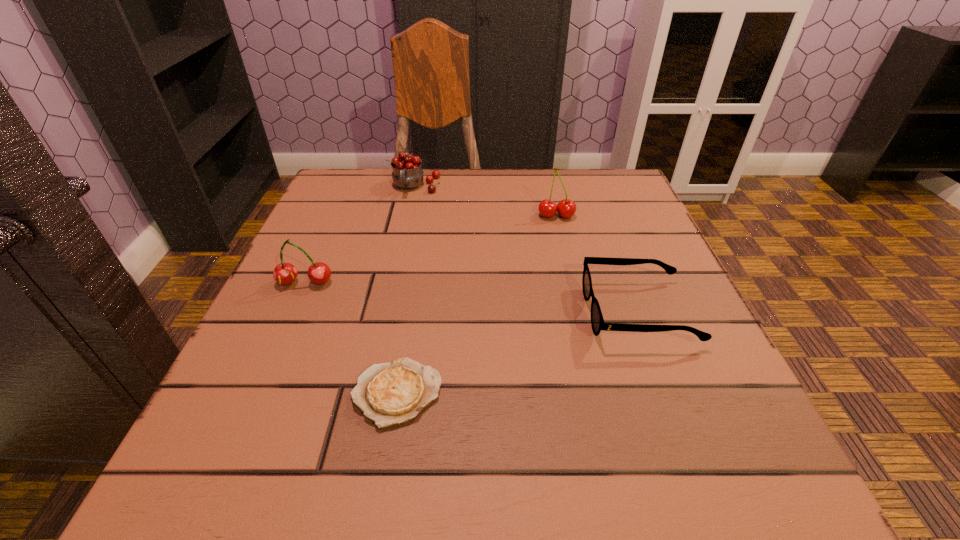
In order to click on vacant area located with the stems of the fourth nearest object pointing upwards in this screenshot , I will do `click(581, 318)`.

This screenshot has width=960, height=540. Find the location of `vacant space located 0.080m with stems pointing upwards on the leftmost object`. vacant space located 0.080m with stems pointing upwards on the leftmost object is located at coordinates (287, 323).

The image size is (960, 540). What are the coordinates of `free location located 0.070m on the arms of the fourth tallest object` in the screenshot? It's located at (547, 312).

At what (x,y) coordinates should I click in order to perform the action: click on vacant area located on the arms of the fourth tallest object. Please return your answer as a coordinate pair (x, y). Looking at the image, I should click on (372, 312).

In order to click on free space located 0.100m on the arms of the fourth tallest object in this screenshot , I will do `click(529, 312)`.

Identify the location of free spot located 0.400m on the back of the shortest object. Image resolution: width=960 pixels, height=540 pixels. (426, 216).

In order to click on cherry at the right edge in this screenshot , I will do `click(566, 208)`.

Find the location of a particular element. The height and width of the screenshot is (540, 960). spectacles at the right edge is located at coordinates (597, 322).

Find the location of a particular element. This screenshot has width=960, height=540. object that is at the far left corner is located at coordinates (407, 174).

Where is `object at the far right corner`? This screenshot has width=960, height=540. object at the far right corner is located at coordinates (566, 208).